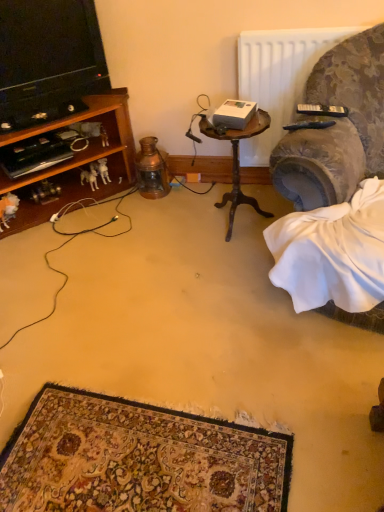
Find the location of `free spot to the left of velvet fabric couch at right`. free spot to the left of velvet fabric couch at right is located at coordinates (224, 197).